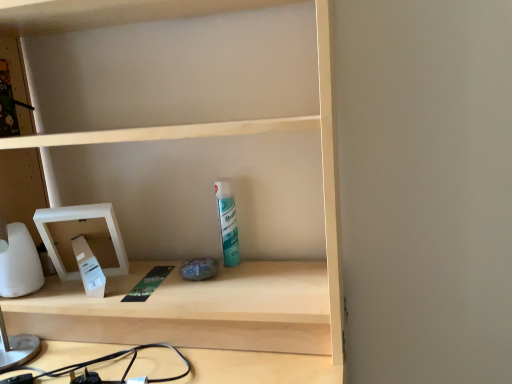
What do you see at coordinates (227, 222) in the screenshot?
I see `white glossy can at center` at bounding box center [227, 222].

This screenshot has height=384, width=512. In order to click on white glossy can at center in this screenshot , I will do `click(227, 222)`.

The image size is (512, 384). Describe the element at coordinates (84, 235) in the screenshot. I see `white plastic medicine cabinet at left` at that location.

Identify the location of white plastic medicine cabinet at left. The height and width of the screenshot is (384, 512). (84, 235).

Locate an element on the screen. The width and height of the screenshot is (512, 384). white glossy can at center is located at coordinates (227, 222).

Considering the positions of objects white glossy can at center and white plastic medicine cabinet at left in the image provided, who is more to the right, white glossy can at center or white plastic medicine cabinet at left?

Positioned to the right is white glossy can at center.

Considering their positions, is white glossy can at center located in front of or behind white plastic medicine cabinet at left?

white glossy can at center is positioned farther from the viewer than white plastic medicine cabinet at left.

Between point (224, 236) and point (102, 219), which one is positioned behind?

The point (224, 236) is behind.

From the image's perspective, is white glossy can at center on top of white plastic medicine cabinet at left?

Yes.

From a real-world perspective, who is located higher, white glossy can at center or white plastic medicine cabinet at left?

From a 3D spatial view, white glossy can at center is above.

Between white glossy can at center and white plastic medicine cabinet at left, which one has larger width?

With larger width is white plastic medicine cabinet at left.

Considering the sizes of objects white glossy can at center and white plastic medicine cabinet at left in the image provided, who is taller, white glossy can at center or white plastic medicine cabinet at left?

Standing taller between the two is white plastic medicine cabinet at left.

Who is smaller, white glossy can at center or white plastic medicine cabinet at left?

white glossy can at center.

Is white plastic medicine cabinet at left completely or partially inside white glossy can at center?

Actually, white plastic medicine cabinet at left is outside white glossy can at center.

Are white glossy can at center and white plastic medicine cabinet at left located far from each other?

Actually, white glossy can at center and white plastic medicine cabinet at left are a little close together.

Looking at this image, is white glossy can at center oriented towards white plastic medicine cabinet at left?

No.

What's the angular difference between white glossy can at center and white plastic medicine cabinet at left's facing directions?

The facing directions of white glossy can at center and white plastic medicine cabinet at left are 16.9 degrees apart.

The height and width of the screenshot is (384, 512). In the image, there is a white glossy can at center. In order to click on medicine cabinet below it (from the image's perspective) in this screenshot , I will do `click(84, 235)`.

Between white plastic medicine cabinet at left and white glossy can at center, which one appears on the right side from the viewer's perspective?

From the viewer's perspective, white glossy can at center appears more on the right side.

Is the position of white plastic medicine cabinet at left more distant than that of white glossy can at center?

No, it is in front of white glossy can at center.

Is point (97, 215) farther from viewer compared to point (225, 256)?

No, (97, 215) is closer to viewer.

From the image's perspective, is white plastic medicine cabinet at left located beneath white glossy can at center?

Yes, from the image's perspective, white plastic medicine cabinet at left is below white glossy can at center.

From a real-world perspective, is white plastic medicine cabinet at left physically located above or below white glossy can at center?

white plastic medicine cabinet at left is situated lower than white glossy can at center in the real world.

Which of these two, white plastic medicine cabinet at left or white glossy can at center, is wider?

white plastic medicine cabinet at left is wider.

Is white plastic medicine cabinet at left taller than white glossy can at center?

Correct, white plastic medicine cabinet at left is much taller as white glossy can at center.

Considering the sizes of objects white plastic medicine cabinet at left and white glossy can at center in the image provided, who is smaller, white plastic medicine cabinet at left or white glossy can at center?

Smaller between the two is white glossy can at center.

Would you say white plastic medicine cabinet at left is outside white glossy can at center?

Yes.

Is there a large distance between white plastic medicine cabinet at left and white glossy can at center?

They are positioned close to each other.

Is white glossy can at center at the back of white plastic medicine cabinet at left?

white plastic medicine cabinet at left does not have its back to white glossy can at center.

Measure the distance from white plastic medicine cabinet at left to white glossy can at center.

They are 11.87 inches apart.

Identify the location of toiletry above the white plastic medicine cabinet at left (from a real-world perspective). This screenshot has height=384, width=512. click(227, 222).

The height and width of the screenshot is (384, 512). Find the location of `toiletry lying on the right of white plastic medicine cabinet at left`. toiletry lying on the right of white plastic medicine cabinet at left is located at coordinates (227, 222).

The image size is (512, 384). In the image, there is a white plastic medicine cabinet at left. Find the location of `toiletry above it (from the image's perspective)`. toiletry above it (from the image's perspective) is located at coordinates (227, 222).